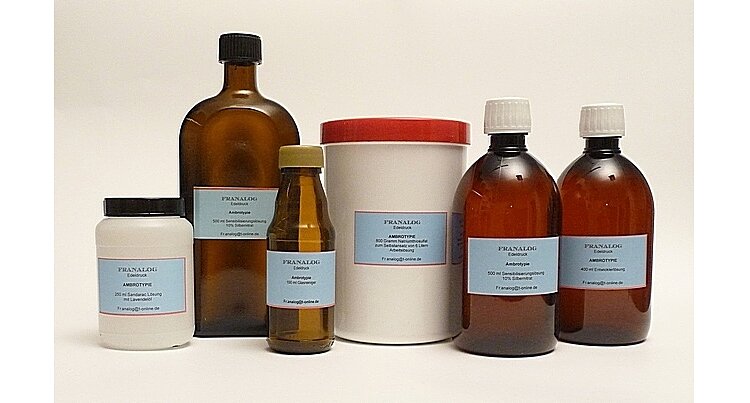
In order to click on plastic jar in this screenshot , I will do `click(412, 159)`.